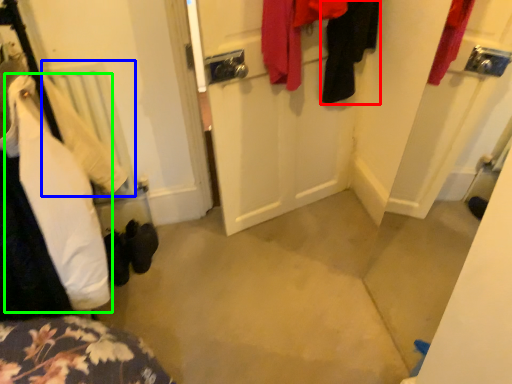
Question: Which object is the farthest from clothing (highlighted by a red box)? Choose among these: radiator (highlighted by a blue box) or clothing (highlighted by a green box).

Choices:
 (A) radiator
 (B) clothing

Answer: (B)